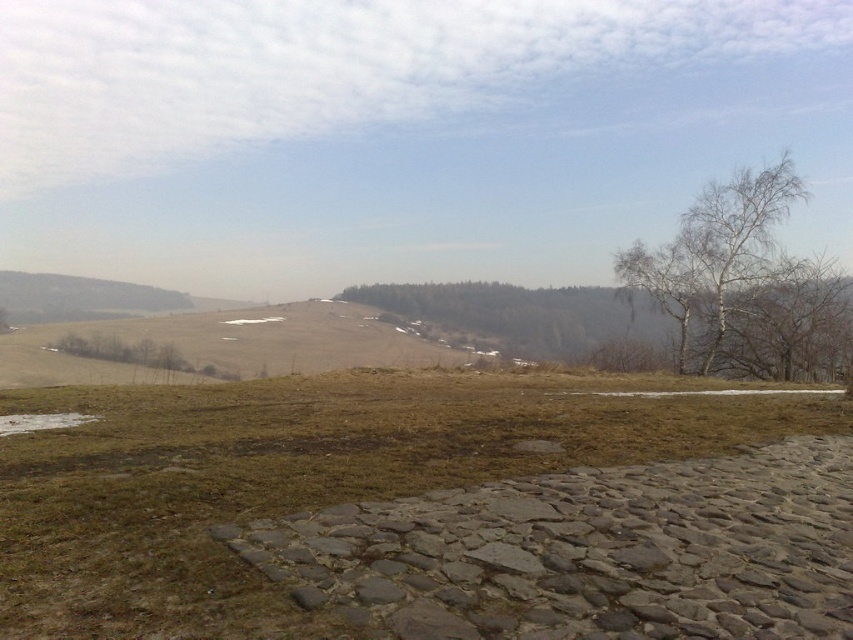
Question: Does brown grass at center have a greater width compared to white bark tree at upper right?

Choices:
 (A) no
 (B) yes

Answer: (B)

Question: Which point is farther to the camera?

Choices:
 (A) (223, 435)
 (B) (764, 243)

Answer: (B)

Question: Which point is closer to the camera?

Choices:
 (A) brown grass at center
 (B) white bark tree at upper right

Answer: (A)

Question: Can you confirm if brown grass at center is thinner than white bark tree at upper right?

Choices:
 (A) no
 (B) yes

Answer: (A)

Question: Observing the image, what is the correct spatial positioning of brown grass at center in reference to white bark tree at upper right?

Choices:
 (A) below
 (B) above

Answer: (A)